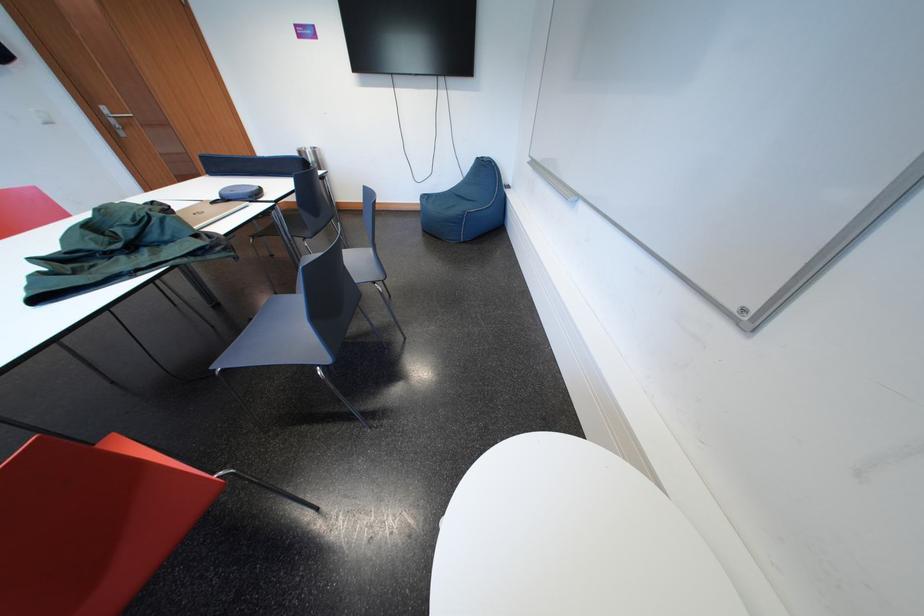
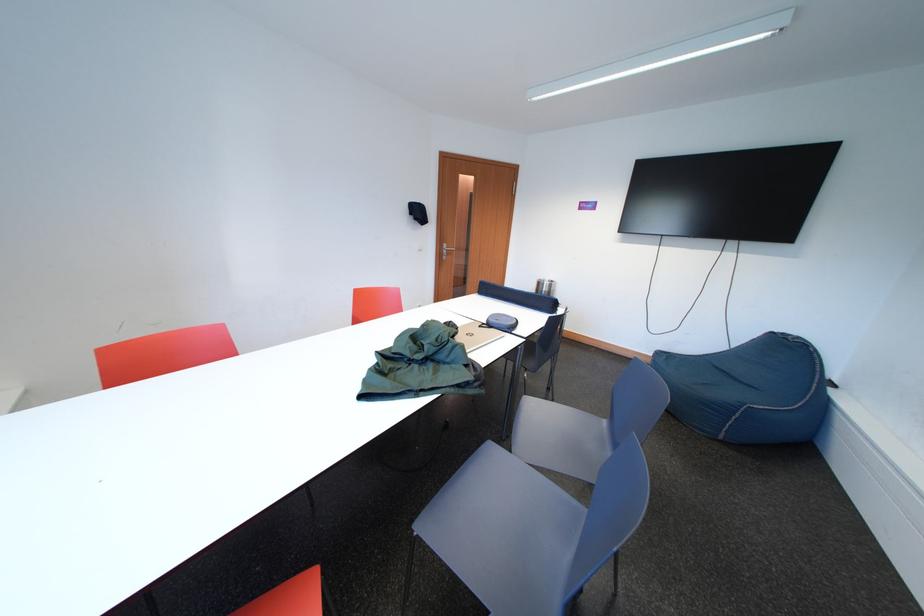
The point at (227, 371) is marked in the first image. Where is the corresponding point in the second image?

(429, 532)